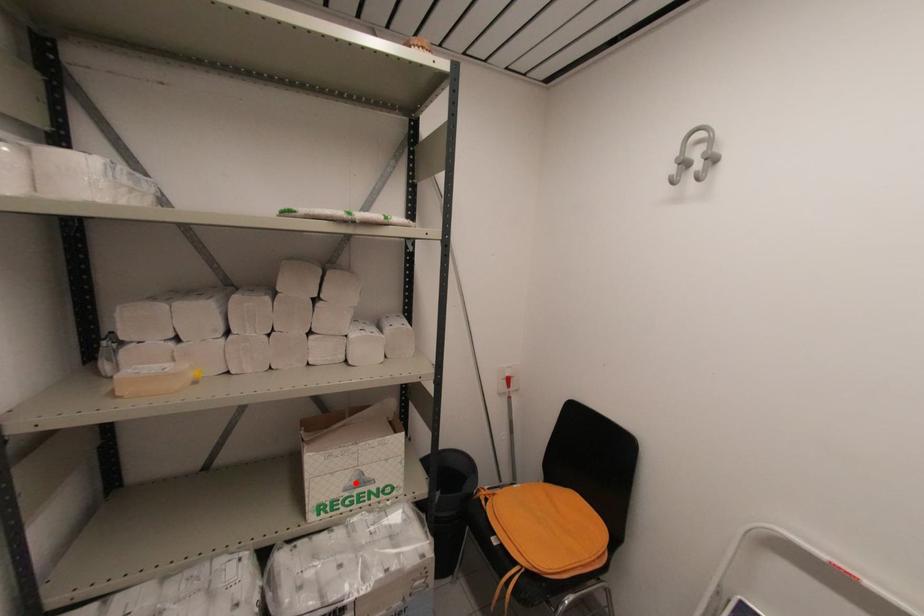
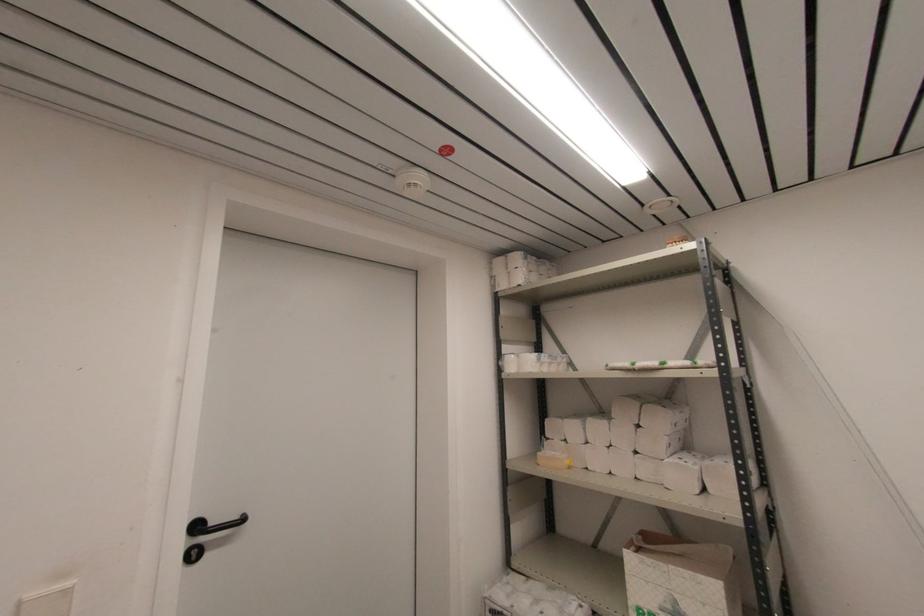
The point at the highlighted location is marked in the first image. Where is the corresponding point in the second image?

(671, 609)